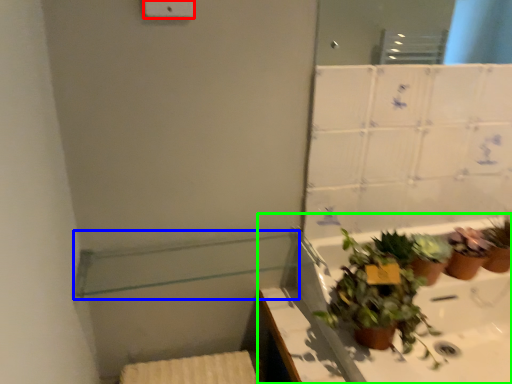
Question: Considering the real-world distances, which object is closest to light switch (highlighted by a red box)? balustrade (highlighted by a blue box) or bath (highlighted by a green box).

Choices:
 (A) balustrade
 (B) bath

Answer: (A)